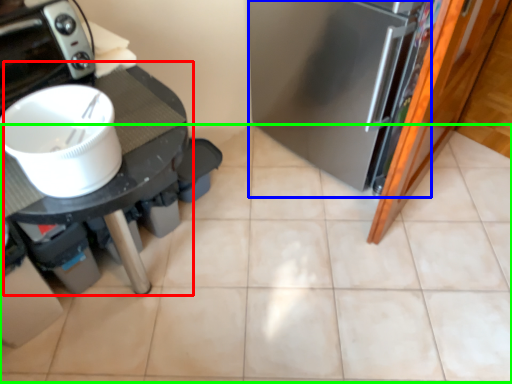
Question: Which is farther away from table (highlighted by a red box)? fridge (highlighted by a blue box) or ceramic tile (highlighted by a green box)?

Choices:
 (A) fridge
 (B) ceramic tile

Answer: (B)